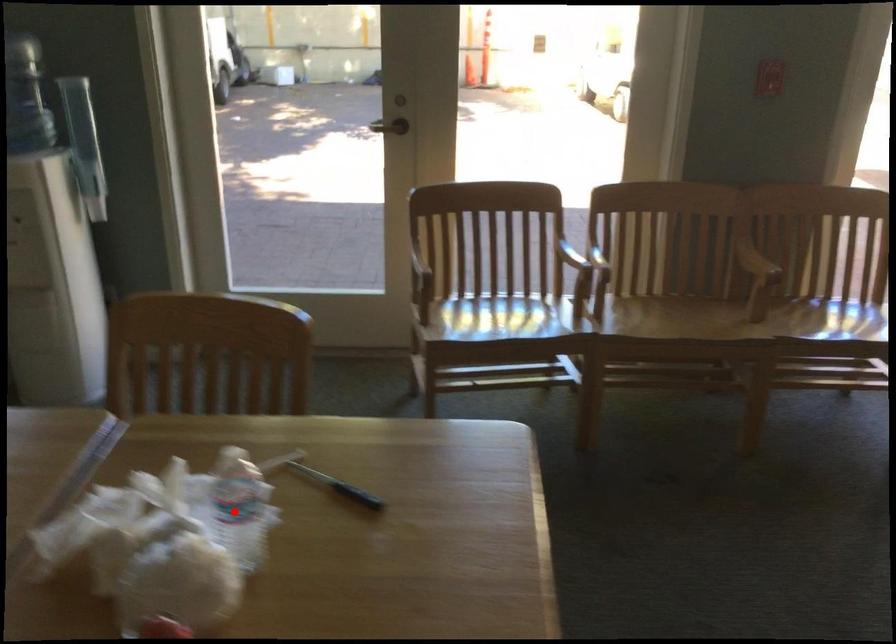
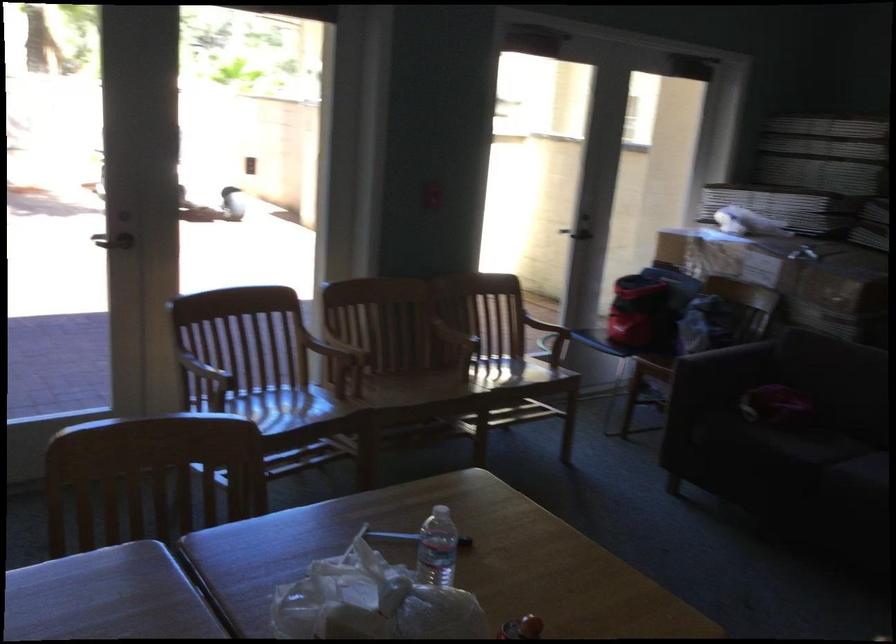
Question: I am providing you with two images of the same scene from different viewpoints. A red point is shown in image1. For the corresponding object point in image2, is it positioned nearer or farther from the camera?

Choices:
 (A) Nearer
 (B) Farther

Answer: (B)